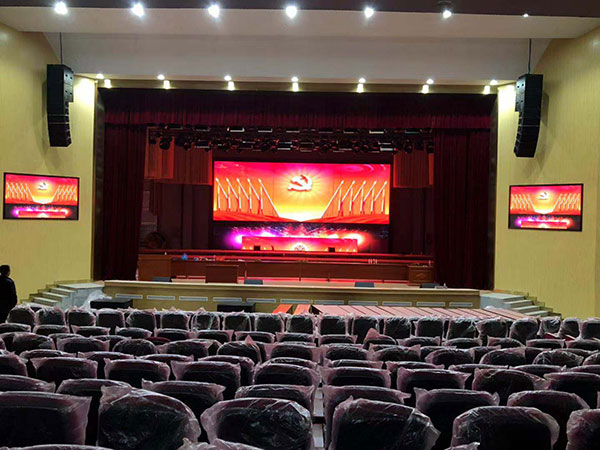
Locate an element on the screen. The height and width of the screenshot is (450, 600). screen is located at coordinates (25, 198), (309, 200), (554, 208).